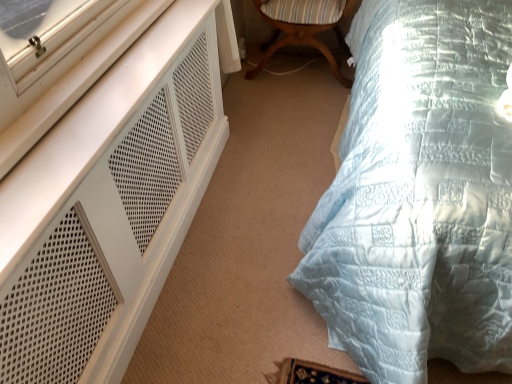
Question: From the image's perspective, relative to white mesh dresser at left, is wooden striped cushion at center above or below?

Choices:
 (A) below
 (B) above

Answer: (B)

Question: From a real-world perspective, relative to white mesh dresser at left, is wooden striped cushion at center vertically above or below?

Choices:
 (A) above
 (B) below

Answer: (B)

Question: Which of these objects is positioned closest to the wooden striped cushion at center?

Choices:
 (A) light blue quilted bed at right
 (B) white mesh dresser at left

Answer: (A)

Question: Estimate the real-world distances between objects in this image. Which object is farther from the wooden striped cushion at center?

Choices:
 (A) light blue quilted bed at right
 (B) white mesh dresser at left

Answer: (B)